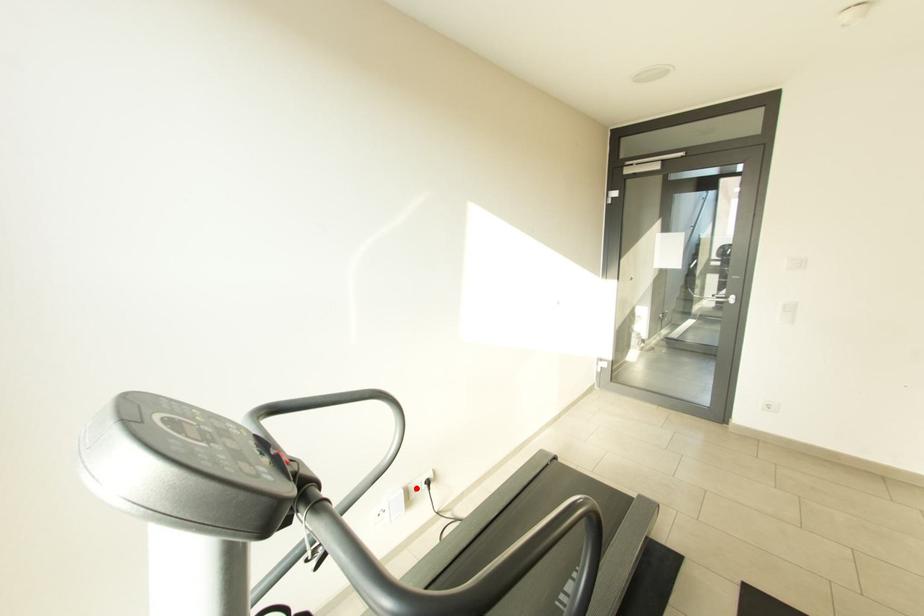
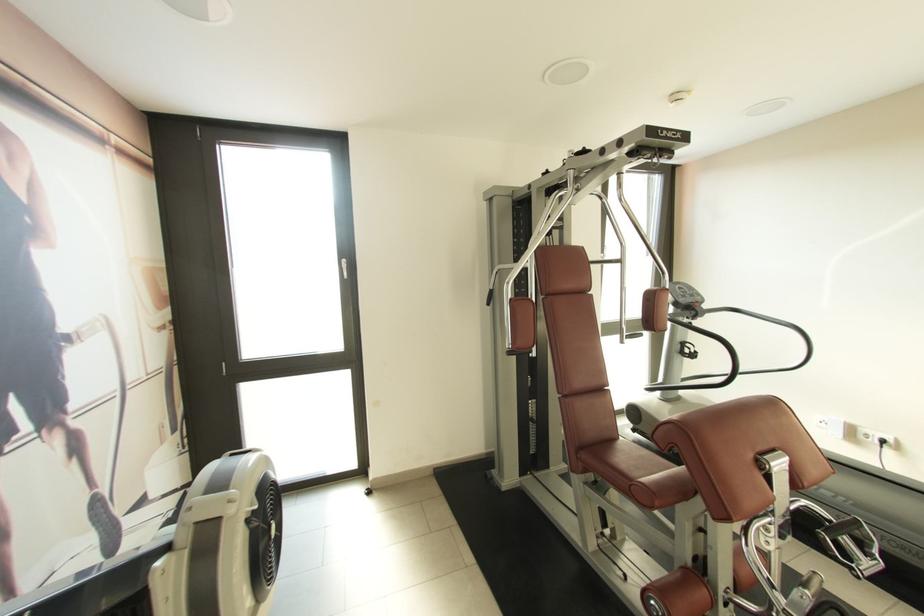
Question: I am providing you with two images of the same scene from different viewpoints. Given a red point in image1, look at the same physical point in image2. Is it:

Choices:
 (A) Closer to the viewpoint
 (B) Farther from the viewpoint

Answer: (A)